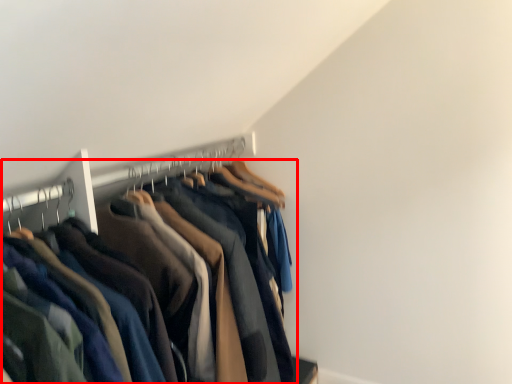
Question: From the image, what is the correct spatial relationship of trousers (annotated by the red box) in relation to hanger?

Choices:
 (A) right
 (B) left

Answer: (B)